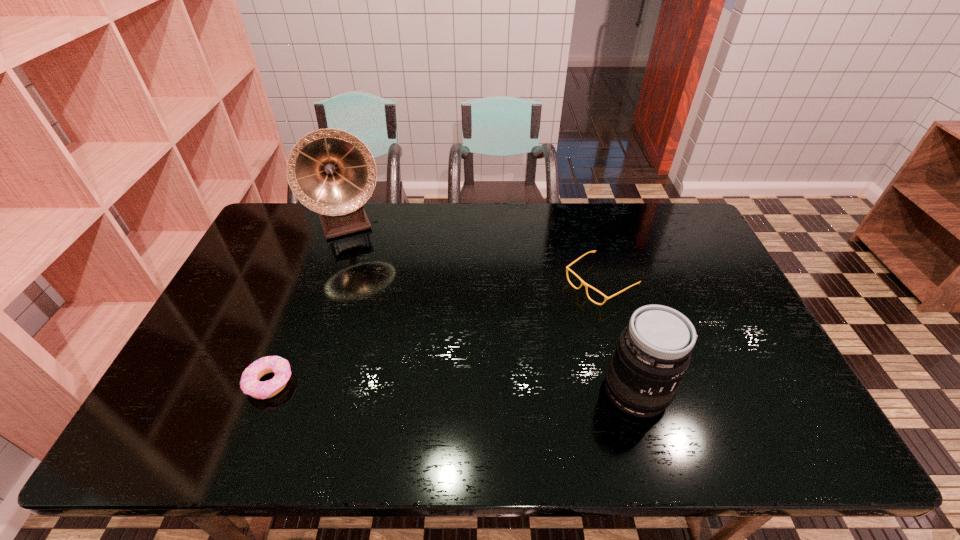
Find the location of a particular element. free spot between the farthest object and the telephoto lens is located at coordinates (493, 307).

Find the location of `object identified as the third closest to the telephoto lens`. object identified as the third closest to the telephoto lens is located at coordinates (330, 171).

Locate which object ranks in proximity to the shortest object. Please provide its 2D coordinates. Your answer should be formatted as a tuple, i.e. [(x, y)], where the tuple contains the x and y coordinates of a point satisfying the conditions above.

[(330, 171)]

Locate an element on the screen. Image resolution: width=960 pixels, height=540 pixels. blank area in the image that satisfies the following two spatial constraints: 1. on the front side of the telephoto lens; 2. on the left side of the shortest object is located at coordinates (267, 390).

You are a GUI agent. You are given a task and a screenshot of the screen. Output one action in this format:
    pyautogui.click(x=<x>, y=<y>)
    Task: Click on the free space that satisfies the following two spatial constraints: 1. on the front side of the third shortest object; 2. on the left side of the shortest object
    This screenshot has width=960, height=540.
    Given the screenshot: What is the action you would take?
    pyautogui.click(x=267, y=390)

Identify the location of free space that satisfies the following two spatial constraints: 1. on the back side of the third tallest object; 2. on the right side of the doughnut. (309, 283).